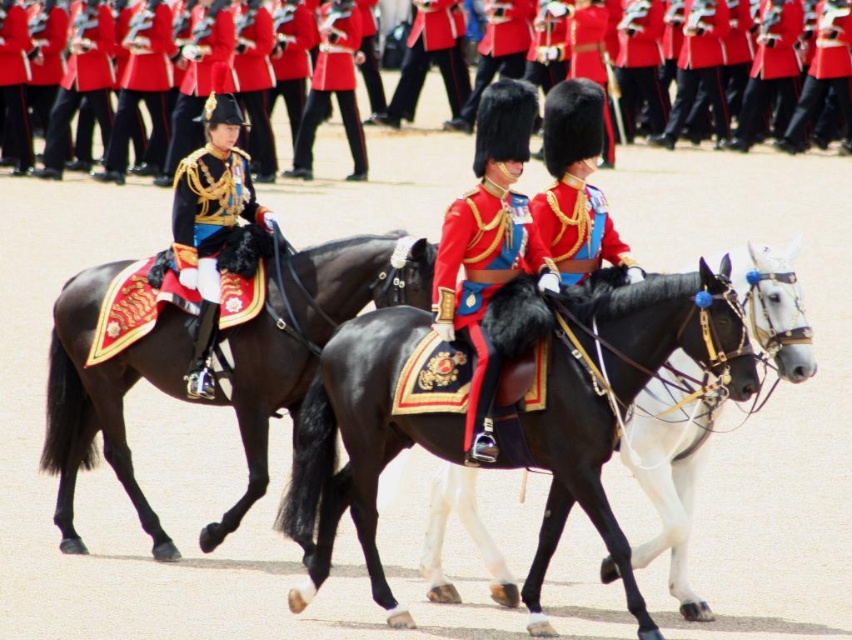
Question: Which object appears farthest from the camera in this image?

Choices:
 (A) black glossy horse at center
 (B) red woolen coat at center
 (C) shiny black horse at left
 (D) shiny gold armor at center

Answer: (B)

Question: Which object is positioned closest to the shiny red coat at center?

Choices:
 (A) red woolen coat at center
 (B) shiny gold armor at center

Answer: (A)

Question: Estimate the real-world distances between objects in this image. Which object is farther from the red velvet jacket at center?

Choices:
 (A) shiny red fabric at center
 (B) shiny black horse at left
 (C) shiny red fabric uniform at center

Answer: (A)

Question: Does red velvet jacket at center appear on the left side of shiny red fabric at center?

Choices:
 (A) no
 (B) yes

Answer: (A)

Question: Does black glossy horse at center appear on the left side of shiny red fabric at center?

Choices:
 (A) no
 (B) yes

Answer: (A)

Question: Where is red velvet jacket at center located in relation to shiny red fabric uniform at center in the image?

Choices:
 (A) above
 (B) below

Answer: (B)